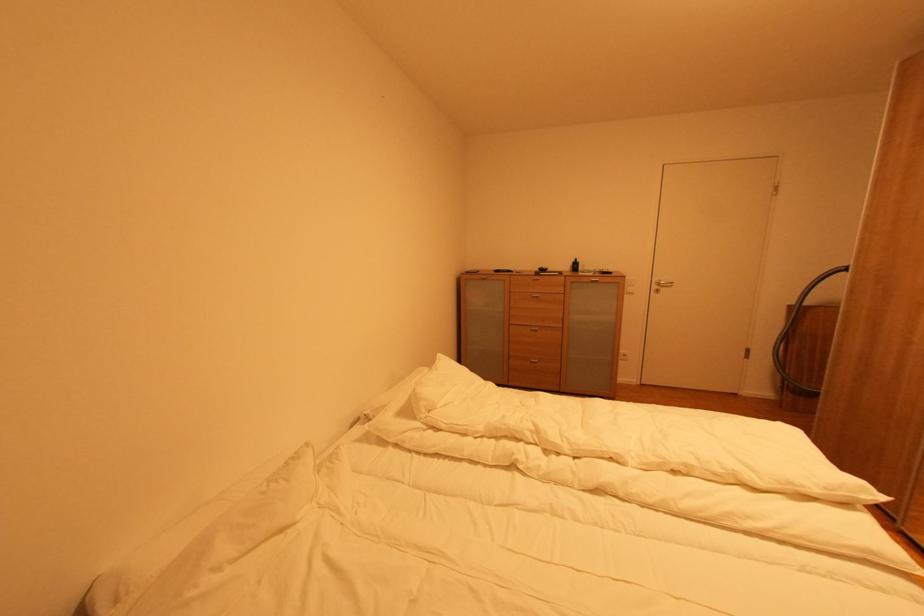
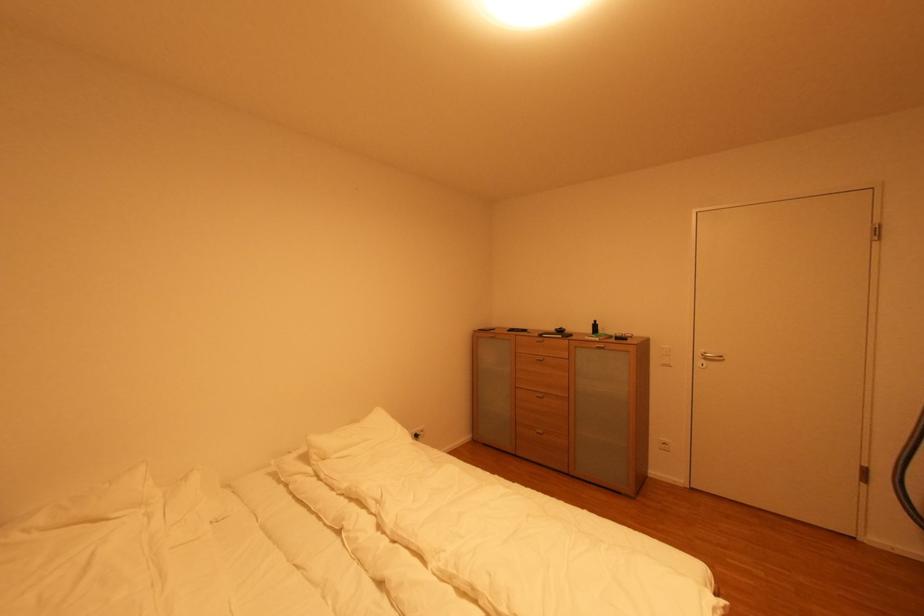
Locate, in the second image, the point that corresponds to pixel 636 294 in the first image.

(670, 367)